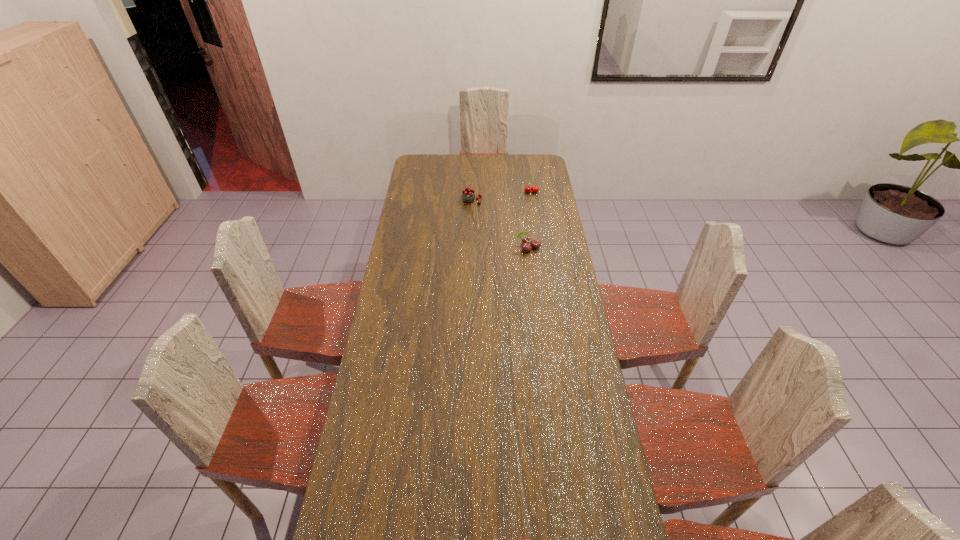
The width and height of the screenshot is (960, 540). Find the location of `the second farthest object`. the second farthest object is located at coordinates (468, 195).

I want to click on the leftmost cherry, so click(468, 195).

Where is `the farthest cherry`? the farthest cherry is located at coordinates (535, 189).

Where is `the second nearest object`? This screenshot has height=540, width=960. the second nearest object is located at coordinates (526, 240).

This screenshot has width=960, height=540. What are the coordinates of `vacant space located on the handle side of the second farthest cherry` in the screenshot? It's located at (471, 215).

Identify the location of vacant point located 0.260m with the stems of the farthest cherry pointing upwards. (536, 224).

This screenshot has height=540, width=960. In order to click on free point located 0.240m on the leaves of the third farthest object in this screenshot , I will do `click(533, 292)`.

At what (x,y) coordinates should I click in order to perform the action: click on free space at the left edge of the desktop. Please return your answer as a coordinate pair (x, y). Looking at the image, I should click on (428, 248).

Locate an element on the screen. This screenshot has width=960, height=540. free region at the right edge of the desktop is located at coordinates (574, 416).

In order to click on free space at the far left corner of the desktop in this screenshot , I will do `click(419, 174)`.